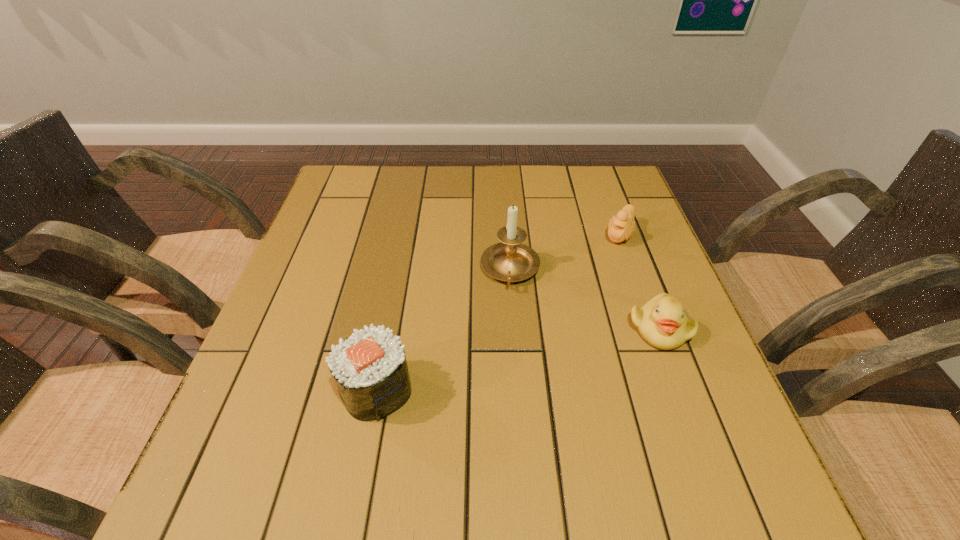
Identify the location of the second closest object to the third object from right to left. Image resolution: width=960 pixels, height=540 pixels. (621, 227).

Find the location of a particular element. Image resolution: width=960 pixels, height=540 pixels. object identified as the second closest to the leftmost object is located at coordinates (662, 323).